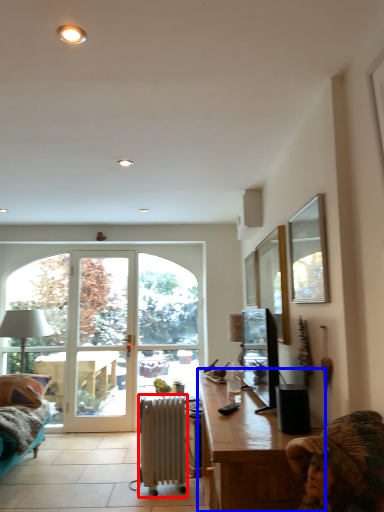
Question: Which object is further to the camera taking this photo, radiator (highlighted by a red box) or desk (highlighted by a blue box)?

Choices:
 (A) radiator
 (B) desk

Answer: (A)